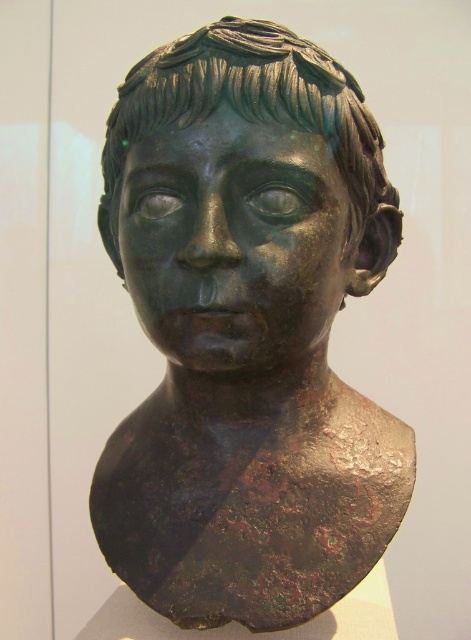
You are an art conservator examining the bronze bust. You notice two points on the sculpture labeled as point 1 at coordinates point (x=242, y=368) and point 2 at coordinates point (x=281, y=196). Which point is closer to you when standing directly in front of the bust?

Point (x=242, y=368) is closer to you than point (x=281, y=196) because it is further to the viewer.